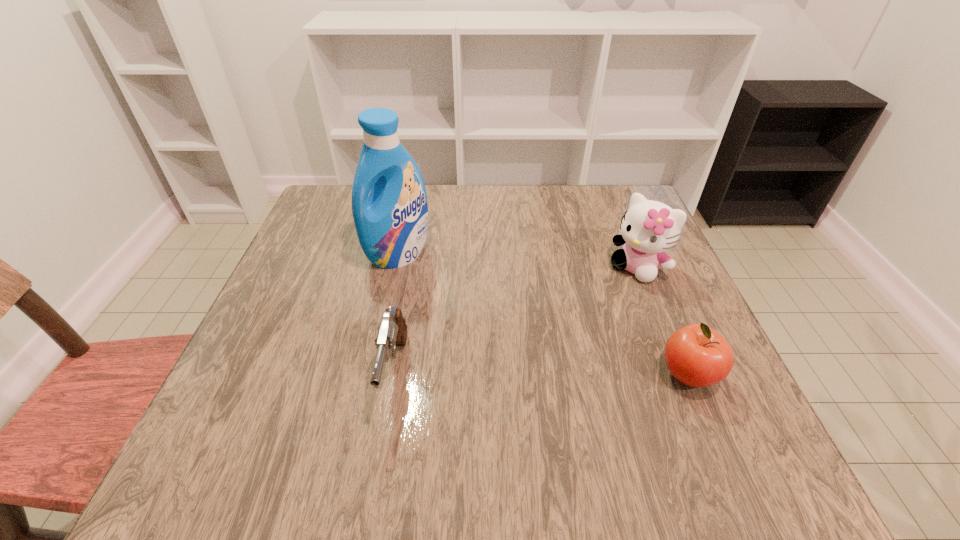
In order to click on pistol in this screenshot , I will do `click(392, 331)`.

You are a GUI agent. You are given a task and a screenshot of the screen. Output one action in this format:
    pyautogui.click(x=<x>, y=<y>)
    Task: Click on the apple
    Image resolution: width=960 pixels, height=540 pixels.
    Given the screenshot: What is the action you would take?
    pyautogui.click(x=696, y=355)

Find the location of a particular element. The height and width of the screenshot is (540, 960). the tallest object is located at coordinates (391, 222).

The height and width of the screenshot is (540, 960). Identify the location of kitten. (648, 228).

Locate an element on the screen. free region located on the back of the apple is located at coordinates (637, 254).

Image resolution: width=960 pixels, height=540 pixels. I want to click on free space located on the front-facing side of the detergent, so click(x=521, y=360).

I want to click on vacant region located on the front-facing side of the detergent, so click(487, 329).

At what (x,y) coordinates should I click in order to perform the action: click on vacant region located on the front-facing side of the detergent. Please return your answer as a coordinate pair (x, y). The image size is (960, 540). Looking at the image, I should click on (496, 338).

I want to click on free space located 0.070m on the front-facing side of the third shortest object, so click(607, 296).

You are a GUI agent. You are given a task and a screenshot of the screen. Output one action in this format:
    pyautogui.click(x=<x>, y=<y>)
    Task: Click on the free region located on the front-facing side of the third shortest object
    The image size is (960, 540).
    Given the screenshot: What is the action you would take?
    pyautogui.click(x=599, y=303)